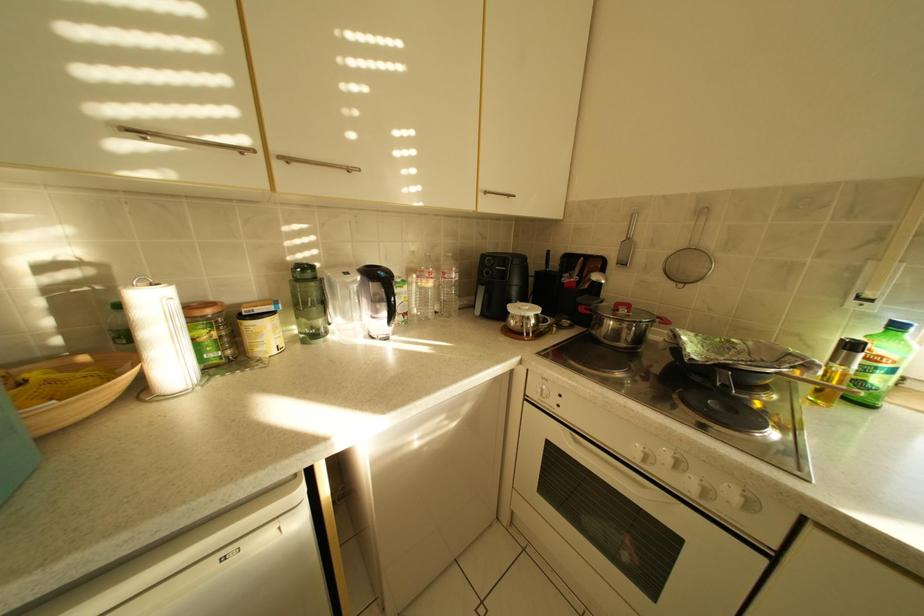
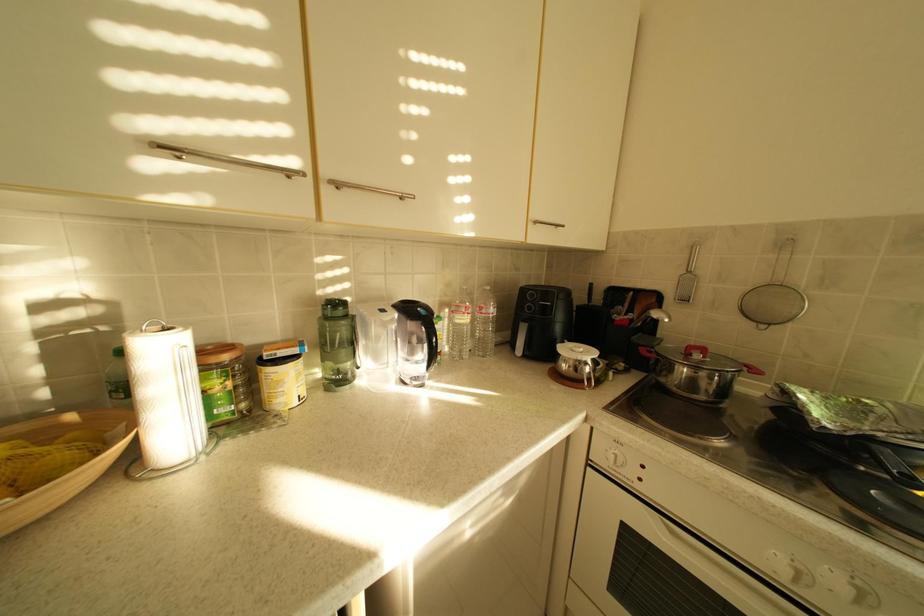
Question: The images are taken continuously from a first-person perspective. In which direction is your viewpoint rotating?

Choices:
 (A) Left
 (B) Right
 (C) Up
 (D) Down

Answer: (C)